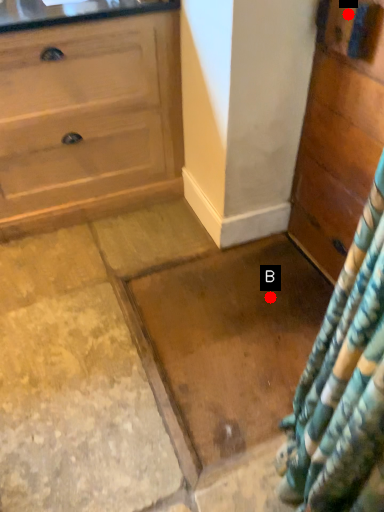
Question: Two points are circled on the image, labeled by A and B beside each circle. Which point is further to the camera?

Choices:
 (A) A is further
 (B) B is further

Answer: (B)